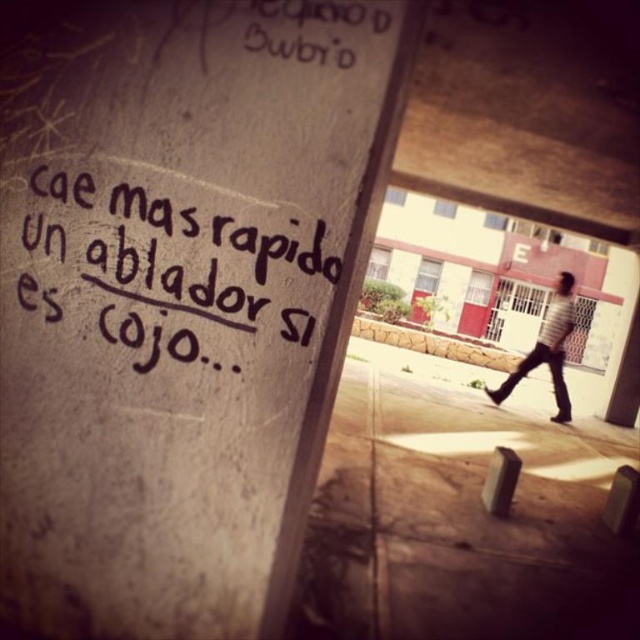
Question: Which of the following is the closest to the observer?

Choices:
 (A) black handwritten text at center
 (B) striped shirt at right

Answer: (A)

Question: Which of the following is the closest to the observer?

Choices:
 (A) (250, 241)
 (B) (520, 378)

Answer: (A)

Question: Among these objects, which one is nearest to the camera?

Choices:
 (A) striped shirt at right
 (B) black handwritten text at center

Answer: (B)

Question: Is black painted concrete sign at upper left to the right of black handwritten text at center from the viewer's perspective?

Choices:
 (A) yes
 (B) no

Answer: (B)

Question: Is black painted concrete sign at upper left above black handwritten text at center?

Choices:
 (A) yes
 (B) no

Answer: (B)

Question: Is black painted concrete sign at upper left positioned behind black handwritten text at center?

Choices:
 (A) yes
 (B) no

Answer: (B)